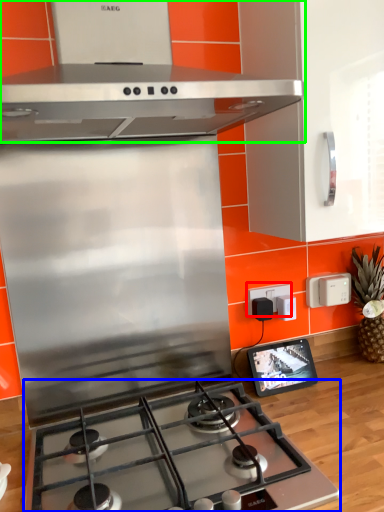
Question: Estimate the real-world distances between objects in this image. Which object is closer to electric outlet (highlighted by a red box), gas stove (highlighted by a blue box) or home appliance (highlighted by a green box)?

Choices:
 (A) gas stove
 (B) home appliance

Answer: (A)